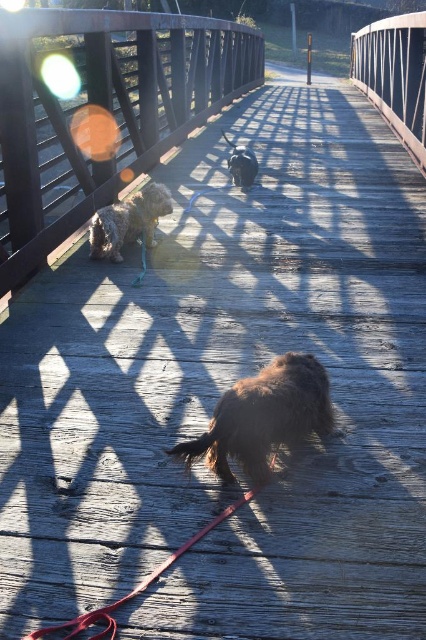
Based on the photo, you are a dog owner who wants to ensure your dogs are safe while walking them across the wooden bridge. Given the scene described, which object would you need to check first to ensure the safety of the fuzzy brown dog at center and the red leather leash at lower center?

You should check the red leather leash at lower center first because it is smaller in size compared to the fuzzy brown dog at center, ensuring it can securely hold the dog.

You are standing on the wooden bridge and see the brown furry dog at center and the red leather leash at lower center. Which object is closer to you?

The brown furry dog at center is closer to you than the red leather leash at lower center.

You are standing on the wooden bridge and see two points marked on the ground. One is at point (298,413) and the other at point (89,246). If you want to walk towards the point that is closer to the front of the bridge, which point should you head towards?

Point (298,413) is in front of point (89,246), so you should head towards point (298,413) to reach the one closer to the front of the bridge.